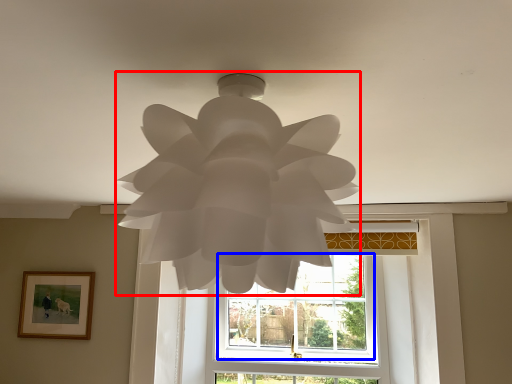
Question: Which of the following is the farthest to the observer, lamp (highlighted by a red box) or window (highlighted by a blue box)?

Choices:
 (A) lamp
 (B) window

Answer: (B)